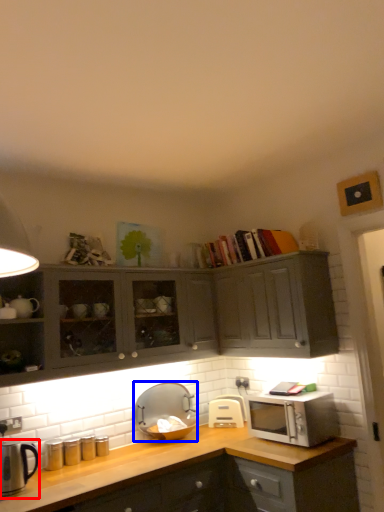
Question: Which point is further to the camera, appliance (highlighted by a red box) or appliance (highlighted by a blue box)?

Choices:
 (A) appliance
 (B) appliance

Answer: (B)